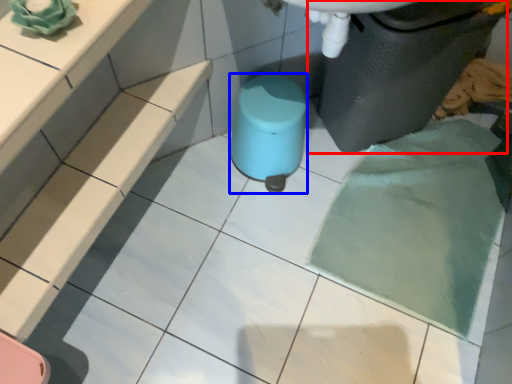
Question: Which object is closer to the camera taking this photo, waste container (highlighted by a red box) or stool (highlighted by a blue box)?

Choices:
 (A) waste container
 (B) stool

Answer: (A)